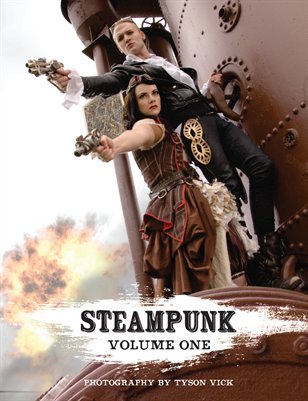
The image size is (308, 401). In order to click on handle in this screenshot , I will do `click(221, 97)`.